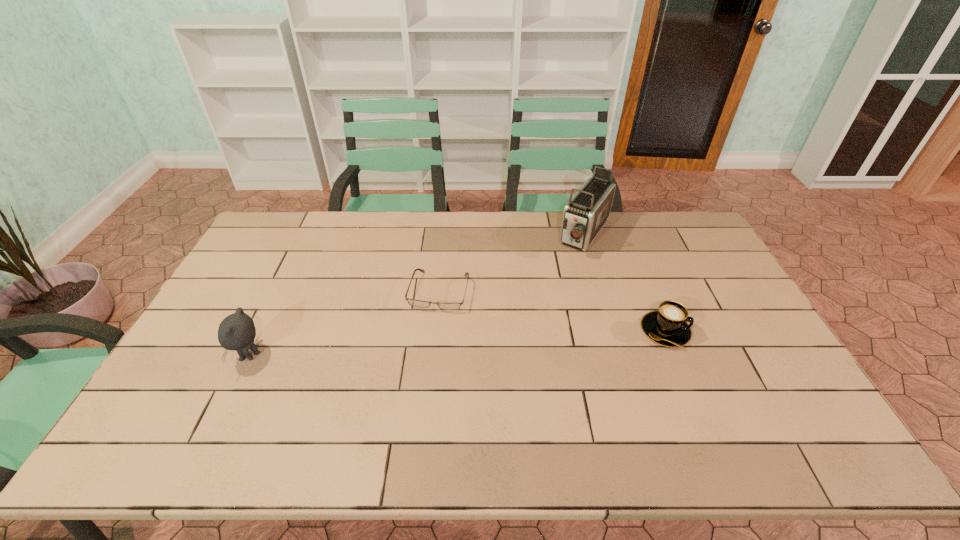
Locate an element on the screen. vacant area at the right edge is located at coordinates coord(684,258).

At what (x,y) coordinates should I click in order to perform the action: click on free space between the tallest object and the second tallest object. Please return your answer as a coordinate pair (x, y). The image size is (960, 540). Looking at the image, I should click on (418, 295).

Identify the location of free space between the farthest object and the cappuccino. The image size is (960, 540). (625, 283).

The width and height of the screenshot is (960, 540). Find the location of `vacant space that is in between the tallest object and the cappuccino`. vacant space that is in between the tallest object and the cappuccino is located at coordinates (625, 283).

This screenshot has height=540, width=960. I want to click on free space between the cappuccino and the third object from right to left, so click(552, 311).

You are a GUI agent. You are given a task and a screenshot of the screen. Output one action in this format:
    pyautogui.click(x=<x>, y=<y>)
    Task: Click on the free spot between the leftmost object and the camcorder
    
    Given the screenshot: What is the action you would take?
    pyautogui.click(x=418, y=295)

In order to click on vacant space that's between the tallest object and the third object from right to left in this screenshot , I will do `click(513, 263)`.

I want to click on blank region between the spectacles and the second shortest object, so [552, 311].

The height and width of the screenshot is (540, 960). Identify the location of empty space that is in between the second tallest object and the farthest object. (418, 295).

Where is `vacant area that lies between the camcorder and the kitten`? vacant area that lies between the camcorder and the kitten is located at coordinates (418, 295).